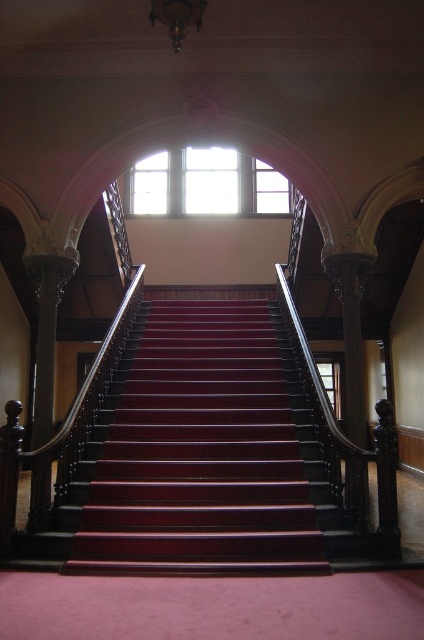
Describe the element at coordinates (200, 456) in the screenshot. The height and width of the screenshot is (640, 424). I see `mahogany stairs at center` at that location.

Which is below, mahogany stairs at center or clear glass window at upper center?

mahogany stairs at center is below.

Is point (310, 500) positioned after point (247, 188)?

No, (310, 500) is in front of (247, 188).

Identify the location of mahogany stairs at center. Image resolution: width=424 pixels, height=640 pixels. (200, 456).